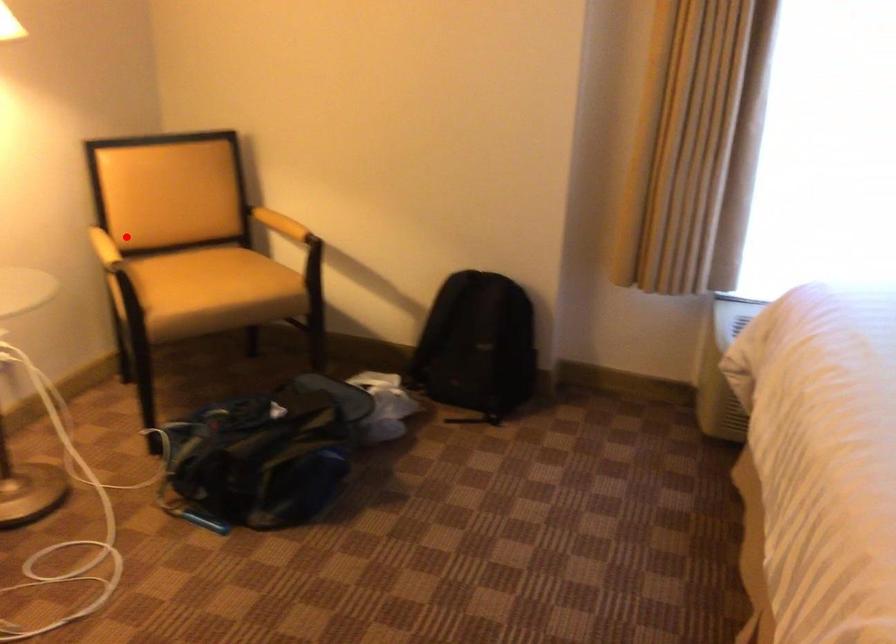
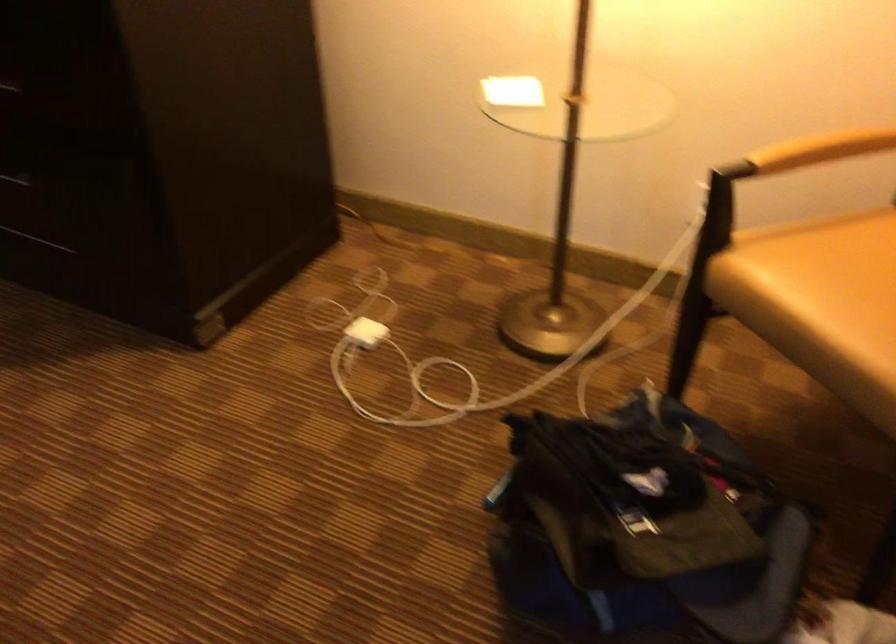
Find the pixel in the second image that matches the highlighted location in the first image.

(821, 149)